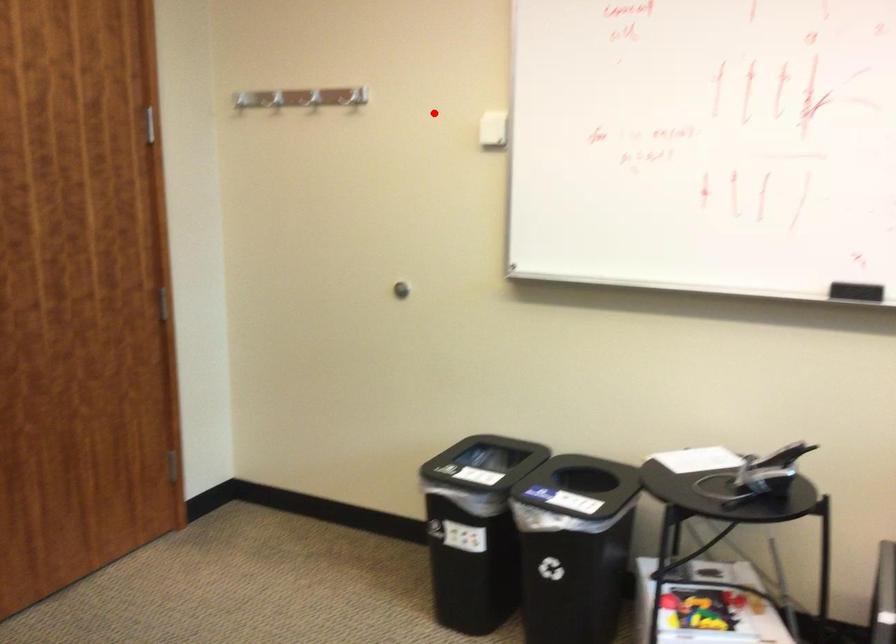
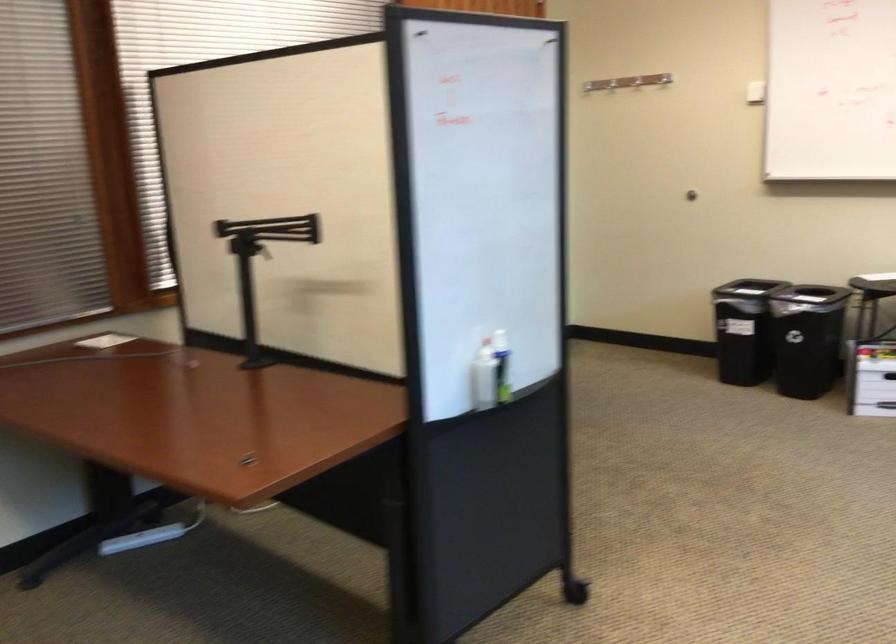
In the second image, find the point that corresponds to the highlighted location in the first image.

(636, 82)